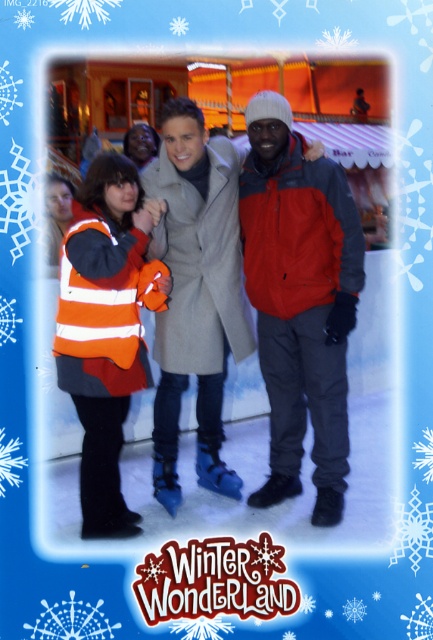
In the Winter Wonderland photo, there are two people wearing orange reflective vest at center and matte red jacket at center. Which one is positioned to the left?

The orange reflective vest at center is to the left of the matte red jacket at center.

From the picture: What object is located at the coordinates point (255, 292) in the image?

The point (255, 292) marks the orange reflective vest at center.

Consider the image. You are organizing a safety briefing for winter workers and need to identify which vest is taller between the orange reflective vest at center and the orange striped vest at center. Which one should you point out?

The orange reflective vest at center has a greater height compared to the orange striped vest at center, so you should point out the orange reflective vest at center.